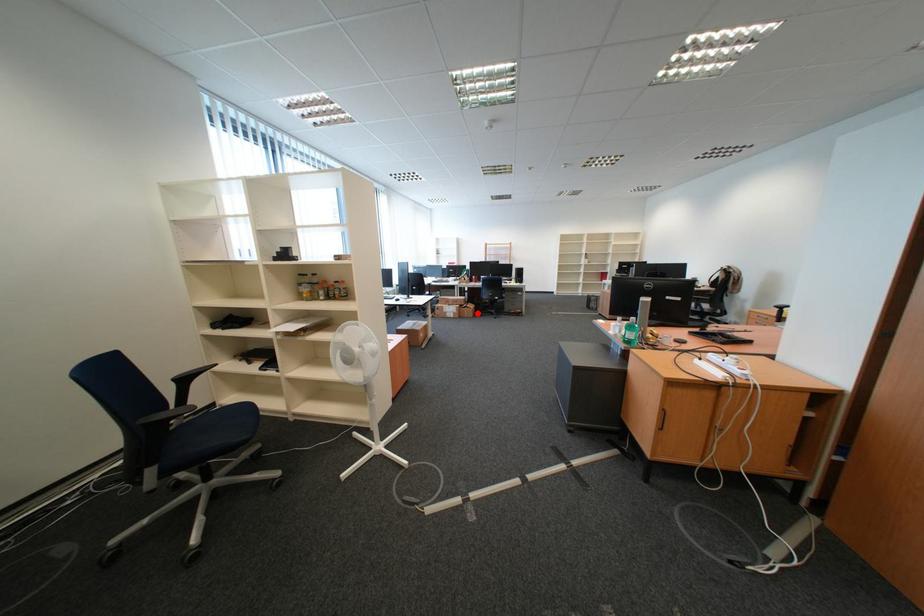
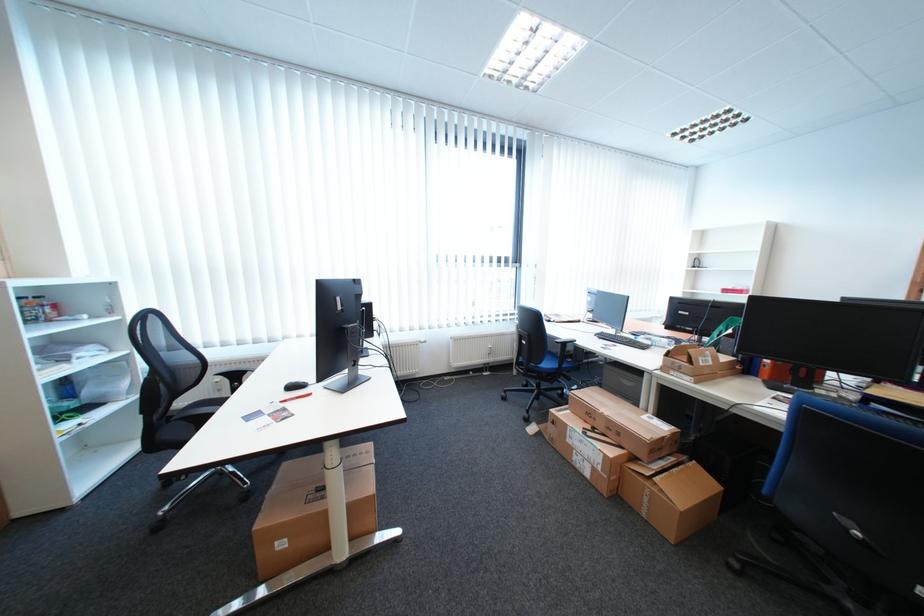
Question: I am providing you with two images of the same scene from different viewpoints. A red point is shown in image1. For the corresponding object point in image2, is it positioned nearer or farther from the camera?

Choices:
 (A) Nearer
 (B) Farther

Answer: (B)